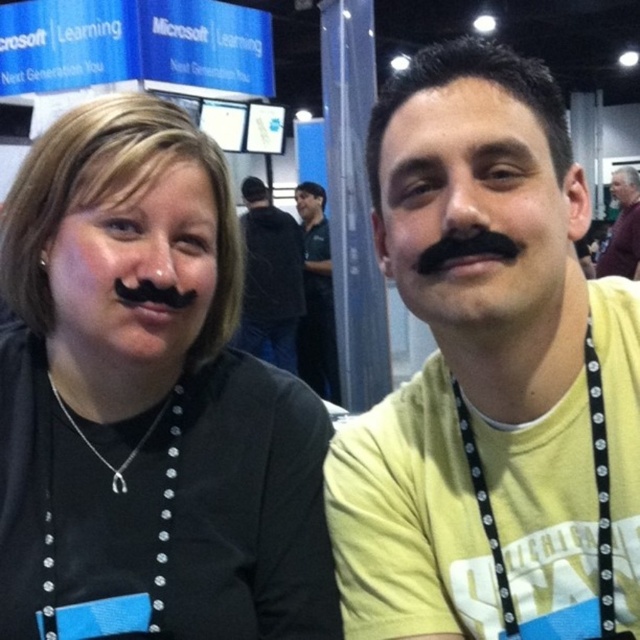
You are standing at the convention and want to take a photo of both the point at coordinates point (620,625) and point (272,300). Which point should you focus on first to ensure both are in frame?

You should focus on point (272,300) first because it is behind point (620,625), so framing from the back to front will include both points in the photo.

You are standing in the convention hall and want to take a photo of the point at coordinates (472, 502). The camera you are using has a minimum focus distance of 25 inches. Will the camera be able to focus on the point?

The point at coordinates (472, 502) is 27.37 inches from the viewer, which is beyond the camera minimum focus distance of 25 inches. Therefore, the camera should be able to focus on the point.

You are a photographer at the event and need to adjust the lighting so that both the yellow cotton shirt at center and the purple shirt at upper right are equally visible. Considering their positions and sizes, which shirt should you focus on first to ensure proper exposure?

The yellow cotton shirt at center is not as tall as the purple shirt at upper right. Since the yellow cotton shirt is smaller, you should focus on adjusting the lighting for it first to ensure it receives adequate exposure before balancing the purple shirt at upper right.